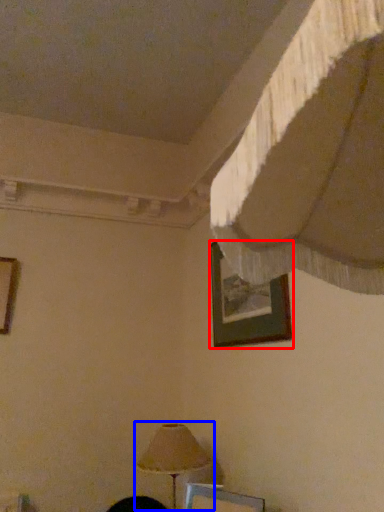
Question: Among these objects, which one is farthest to the camera, picture frame (highlighted by a red box) or lamp (highlighted by a blue box)?

Choices:
 (A) picture frame
 (B) lamp

Answer: (B)